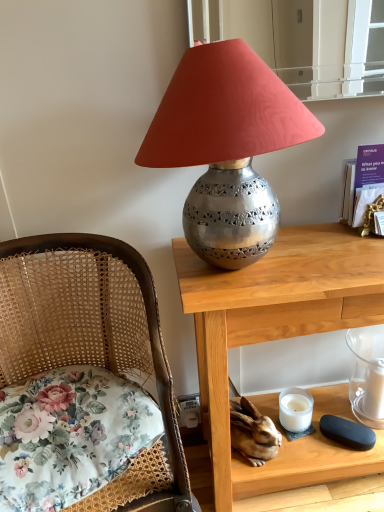
Question: Considering the relative positions of floral fabric cushion at left and transparent glass candle at lower right, acting as the first candle holder starting from the right, in the image provided, is floral fabric cushion at left to the left of transparent glass candle at lower right, acting as the first candle holder starting from the right, from the viewer's perspective?

Choices:
 (A) no
 (B) yes

Answer: (B)

Question: Would you say floral fabric cushion at left is outside transparent glass candle at lower right, acting as the first candle holder starting from the right?

Choices:
 (A) no
 (B) yes

Answer: (B)

Question: Can you confirm if floral fabric cushion at left is thinner than transparent glass candle at lower right, which is counted as the 2th candle holder, starting from the left?

Choices:
 (A) no
 (B) yes

Answer: (A)

Question: Is there a large distance between floral fabric cushion at left and transparent glass candle at lower right, which is counted as the 2th candle holder, starting from the left?

Choices:
 (A) no
 (B) yes

Answer: (A)

Question: From the image's perspective, is floral fabric cushion at left below transparent glass candle at lower right, acting as the first candle holder starting from the right?

Choices:
 (A) yes
 (B) no

Answer: (A)

Question: Based on their positions, is polished wood desk at center located to the left or right of white matte candle at lower right?

Choices:
 (A) left
 (B) right

Answer: (A)

Question: In terms of height, does polished wood desk at center look taller or shorter compared to white matte candle at lower right?

Choices:
 (A) short
 (B) tall

Answer: (B)

Question: Is polished wood desk at center in front of or behind white matte candle at lower right in the image?

Choices:
 (A) behind
 (B) front

Answer: (B)

Question: From the image's perspective, is polished wood desk at center above or below white matte candle at lower right?

Choices:
 (A) below
 (B) above

Answer: (B)

Question: Considering the positions of point (377, 414) and point (173, 240), is point (377, 414) closer or farther from the camera than point (173, 240)?

Choices:
 (A) farther
 (B) closer

Answer: (A)

Question: Looking at the image, does white matte candle at lower right seem bigger or smaller compared to polished wood desk at center?

Choices:
 (A) small
 (B) big

Answer: (A)

Question: From a real-world perspective, relative to polished wood desk at center, is white matte candle at lower right vertically above or below?

Choices:
 (A) below
 (B) above

Answer: (A)

Question: Considering their positions, is white matte candle at lower right located in front of or behind polished wood desk at center?

Choices:
 (A) behind
 (B) front

Answer: (A)

Question: Would you say white matte candle at lower right is inside or outside transparent glass candle at lower right, which is counted as the 2th candle holder, starting from the left?

Choices:
 (A) inside
 (B) outside

Answer: (A)

Question: Considering the positions of white matte candle at lower right and transparent glass candle at lower right, acting as the first candle holder starting from the right, in the image, is white matte candle at lower right bigger or smaller than transparent glass candle at lower right, acting as the first candle holder starting from the right,?

Choices:
 (A) small
 (B) big

Answer: (A)